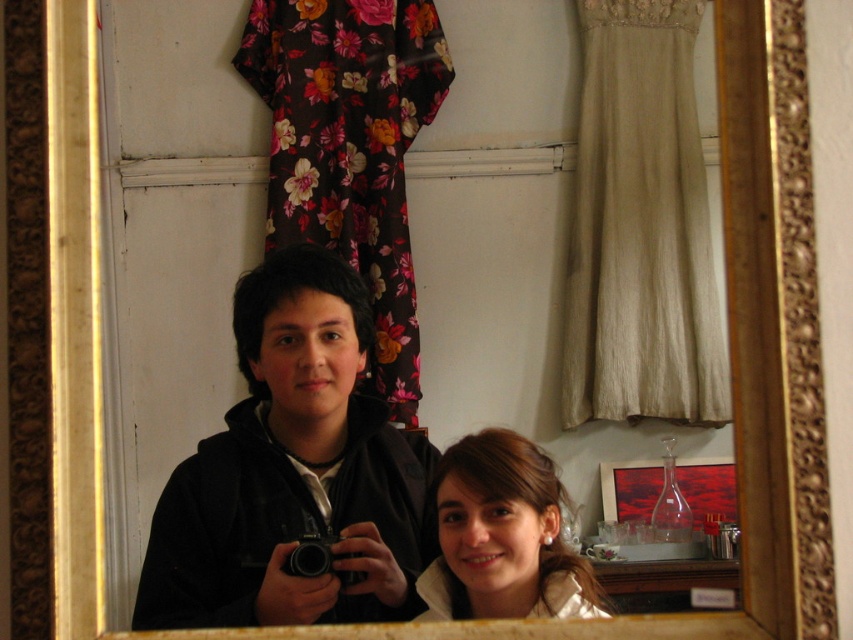
You are standing in front of the mirror and notice two points marked in the reflection. The first point is at coordinate point (x=527, y=561) and the second point is at coordinate point (x=293, y=564). Which point is closer to you?

Point (x=527, y=561) is further to the camera than point (x=293, y=564), so the point closer to you is point (x=293, y=564).

You are standing in front of the mirror and see two points reflected in the mirror. The first point is at coordinate point (289,353) and the second is at point (486,540). Based on their positions in the mirror, which point is closer to you?

Point (486,540) is closer to you because in the mirror reflection, objects that are physically closer to the mirror appear farther away in the reflection. Since point (289,353) is behind point (486,540) in the real scene, its reflection would be in front of the other point in the mirror. Wait, but the description says point (289,353) is behind point (486,540). Hmm, so in the real world, point A is behind point B. In the mirror, reflections reverse left and right, but depth remains the same. A